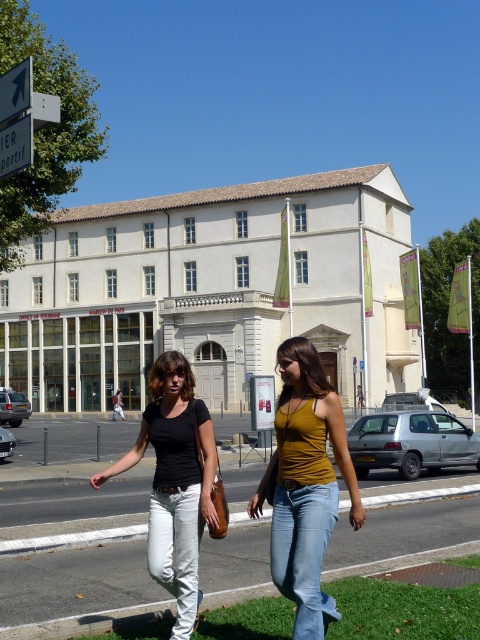
Question: Considering the real-world distances, which object is farthest from the mustard yellow tank top at center?

Choices:
 (A) white denim jeans at lower center
 (B) matte black shirt at center
 (C) blue denim jeans at lower center
 (D) white plastic arrow at upper left

Answer: (D)

Question: Is the position of white denim jeans at lower center less distant than that of white plastic arrow at upper left?

Choices:
 (A) no
 (B) yes

Answer: (B)

Question: Does white plastic sign at upper left lie behind white plastic arrow at upper left?

Choices:
 (A) no
 (B) yes

Answer: (B)

Question: Which of these objects is positioned closest to the white plastic arrow at upper left?

Choices:
 (A) matte black shirt at center
 (B) blue denim jeans at lower center
 (C) white denim jeans at lower center

Answer: (A)

Question: Does matte black shirt at center appear on the left side of blue denim jeans at lower center?

Choices:
 (A) yes
 (B) no

Answer: (A)

Question: Estimate the real-world distances between objects in this image. Which object is farther from the matte black shirt at center?

Choices:
 (A) blue denim jeans at lower center
 (B) white plastic arrow at upper left
 (C) white denim jeans at lower center
 (D) mustard yellow tank top at center

Answer: (B)